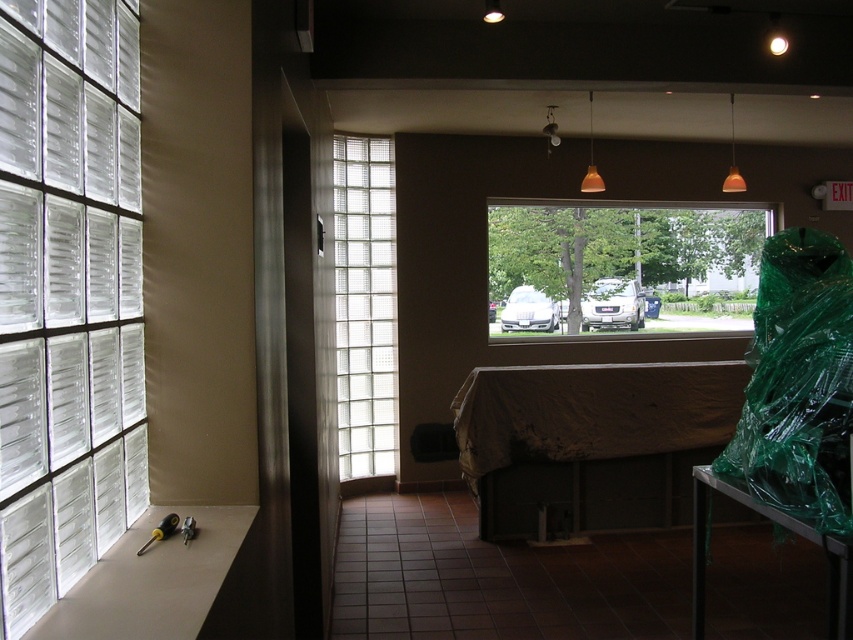
Question: Does green plastic bag at right appear over clear glass block at center?

Choices:
 (A) no
 (B) yes

Answer: (A)

Question: From the image, what is the correct spatial relationship of clear glass blocks at left in relation to transparent glass window at center?

Choices:
 (A) above
 (B) below

Answer: (B)

Question: Which of the following is the farthest from the observer?

Choices:
 (A) transparent glass window at center
 (B) clear glass block at center
 (C) brown fabric at center
 (D) green plastic bag at right

Answer: (A)

Question: Among these points, which one is farthest from the camera?

Choices:
 (A) (811, 280)
 (B) (357, 285)

Answer: (B)

Question: Can you confirm if green plastic bag at right is positioned to the left of clear glass block at center?

Choices:
 (A) no
 (B) yes

Answer: (A)

Question: Which object is the farthest from the green plastic bag at right?

Choices:
 (A) clear glass blocks at left
 (B) clear glass block at center
 (C) brown fabric at center

Answer: (B)